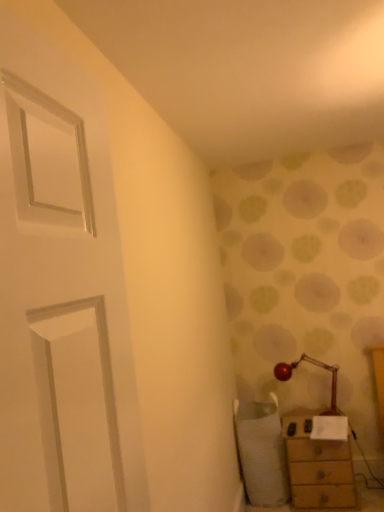
Question: Is wooden chest of drawers at lower right oriented towards white textured swivel chair at lower right?

Choices:
 (A) no
 (B) yes

Answer: (A)

Question: From a real-world perspective, is wooden chest of drawers at lower right located higher than white textured swivel chair at lower right?

Choices:
 (A) yes
 (B) no

Answer: (B)

Question: Is white textured swivel chair at lower right at the back of wooden chest of drawers at lower right?

Choices:
 (A) yes
 (B) no

Answer: (B)

Question: Is wooden chest of drawers at lower right next to white textured swivel chair at lower right and touching it?

Choices:
 (A) no
 (B) yes

Answer: (A)

Question: Is white textured swivel chair at lower right completely or partially inside wooden chest of drawers at lower right?

Choices:
 (A) no
 (B) yes

Answer: (A)

Question: From the image's perspective, is metallic red table lamp at lower right above or below white textured swivel chair at lower right?

Choices:
 (A) below
 (B) above

Answer: (B)

Question: Based on their sizes in the image, would you say metallic red table lamp at lower right is bigger or smaller than white textured swivel chair at lower right?

Choices:
 (A) big
 (B) small

Answer: (B)

Question: Is metallic red table lamp at lower right spatially inside white textured swivel chair at lower right, or outside of it?

Choices:
 (A) outside
 (B) inside

Answer: (A)

Question: In terms of height, does metallic red table lamp at lower right look taller or shorter compared to white textured swivel chair at lower right?

Choices:
 (A) short
 (B) tall

Answer: (A)

Question: From a real-world perspective, is metallic red table lamp at lower right above or below wooden chest of drawers at lower right?

Choices:
 (A) above
 (B) below

Answer: (A)

Question: Based on their positions, is metallic red table lamp at lower right located to the left or right of wooden chest of drawers at lower right?

Choices:
 (A) right
 (B) left

Answer: (B)

Question: From their relative heights in the image, would you say metallic red table lamp at lower right is taller or shorter than wooden chest of drawers at lower right?

Choices:
 (A) tall
 (B) short

Answer: (B)

Question: Looking at their shapes, would you say metallic red table lamp at lower right is wider or thinner than wooden chest of drawers at lower right?

Choices:
 (A) thin
 (B) wide

Answer: (A)

Question: From a real-world perspective, relative to wooden chest of drawers at lower right, is white textured swivel chair at lower right vertically above or below?

Choices:
 (A) below
 (B) above

Answer: (B)

Question: Would you say white textured swivel chair at lower right is inside or outside wooden chest of drawers at lower right?

Choices:
 (A) inside
 (B) outside

Answer: (B)